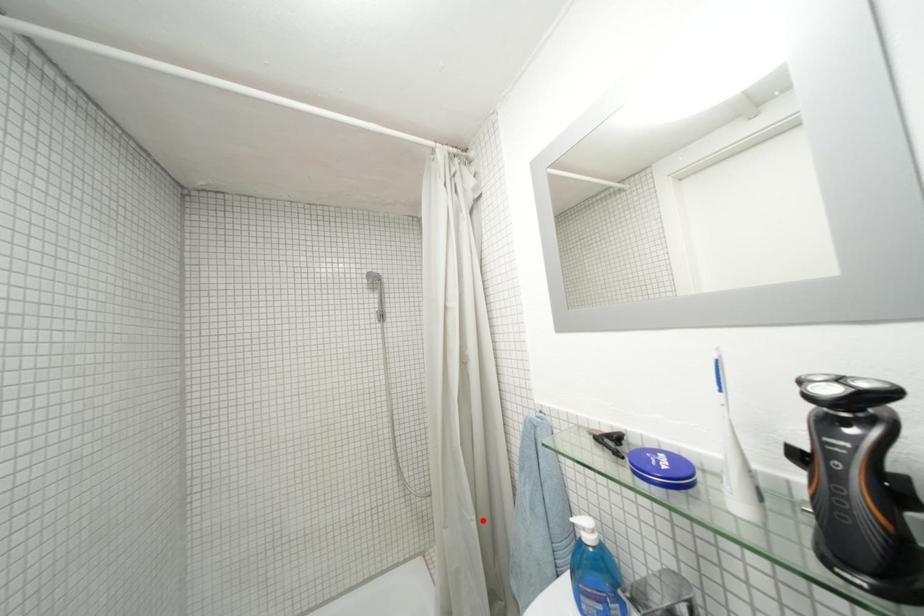
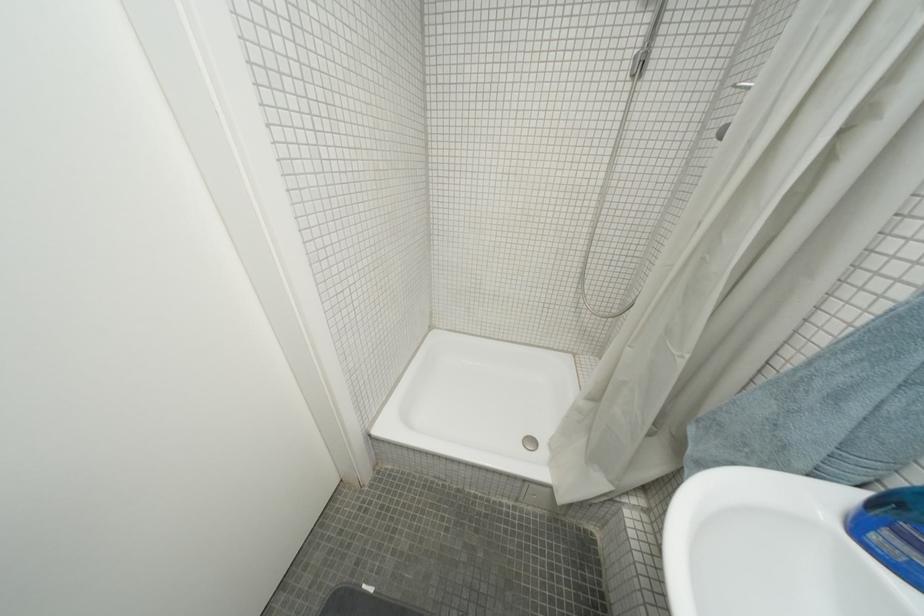
Locate, in the second image, the point that corresponds to the highlighted location in the first image.

(697, 359)